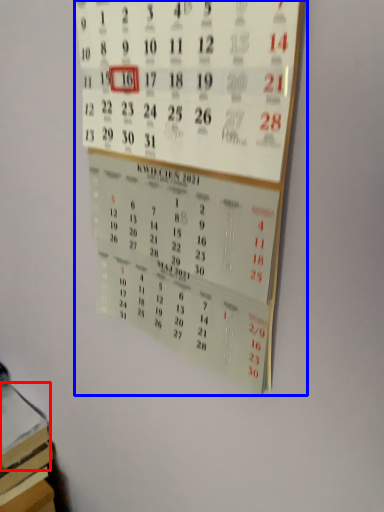
Question: Which point is further to the camera, book (highlighted by a red box) or bulletin board (highlighted by a blue box)?

Choices:
 (A) book
 (B) bulletin board

Answer: (A)